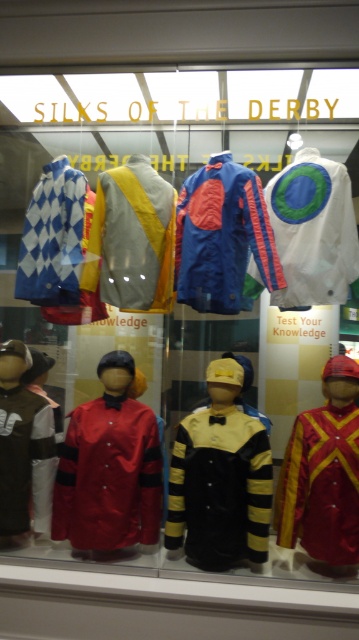
Question: Which point is farther from the camera taking this photo?

Choices:
 (A) (322, 173)
 (B) (1, 429)
 (C) (202, 531)
 (D) (108, 426)

Answer: (A)

Question: Can you confirm if blue satin racing jacket at center is positioned to the left of yellow and gray silk jockey jacket at center?

Choices:
 (A) yes
 (B) no

Answer: (B)

Question: Is the position of shiny red and gold jacket at center less distant than that of white matte jacket at left?

Choices:
 (A) yes
 (B) no

Answer: (A)

Question: Can you confirm if blue satin racing jacket at center is positioned below yellow and gray silk jockey jacket at center?

Choices:
 (A) no
 (B) yes

Answer: (B)

Question: Which of the following is the farthest from the observer?

Choices:
 (A) (189, 496)
 (B) (286, 490)

Answer: (B)

Question: Which point is closer to the camera taking this photo?

Choices:
 (A) (146, 490)
 (B) (288, 292)

Answer: (A)